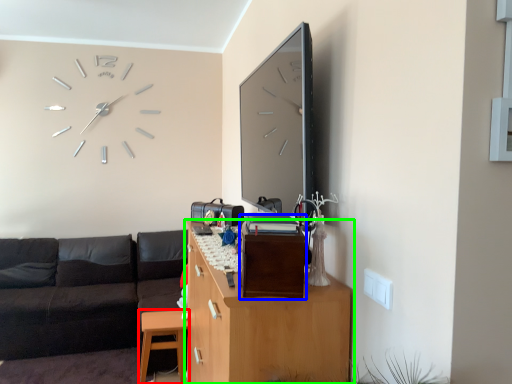
Question: Which object is positioned farthest from table (highlighted by a red box)? Select from file cabinet (highlighted by a blue box) and cabinetry (highlighted by a green box).

Choices:
 (A) file cabinet
 (B) cabinetry

Answer: (A)